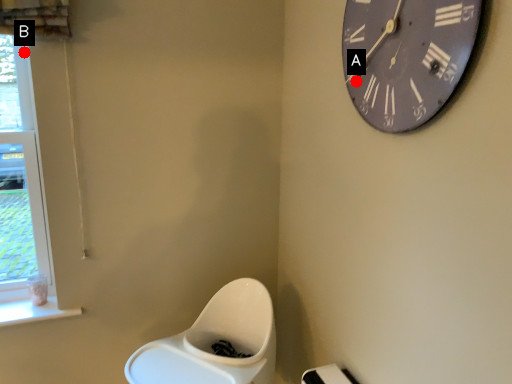
Question: Two points are circled on the image, labeled by A and B beside each circle. Which point is closer to the camera?

Choices:
 (A) A is closer
 (B) B is closer

Answer: (A)